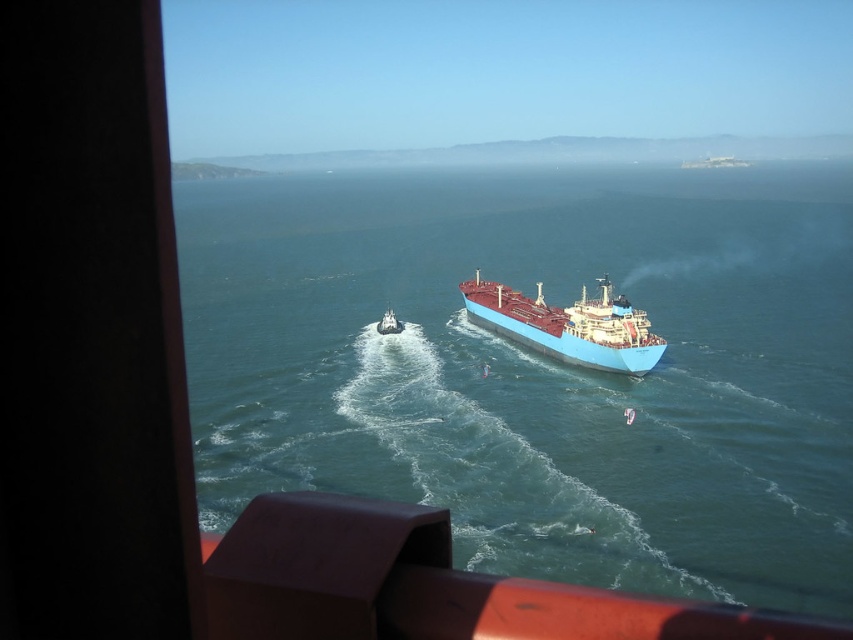
Question: Which object appears closest to the camera in this image?

Choices:
 (A) metallic gray boat at center
 (B) blue matte ship at center
 (C) blue glossy water at center

Answer: (C)

Question: Can you confirm if blue glossy water at center is thinner than metallic gray boat at center?

Choices:
 (A) no
 (B) yes

Answer: (A)

Question: Does blue glossy water at center lie behind metallic gray boat at center?

Choices:
 (A) no
 (B) yes

Answer: (A)

Question: Which is farther from the blue glossy water at center?

Choices:
 (A) blue matte ship at center
 (B) metallic gray boat at center

Answer: (B)

Question: Which of the following is the farthest from the observer?

Choices:
 (A) (767, 268)
 (B) (387, 324)

Answer: (A)

Question: Observing the image, what is the correct spatial positioning of blue matte ship at center in reference to metallic gray boat at center?

Choices:
 (A) left
 (B) right

Answer: (B)